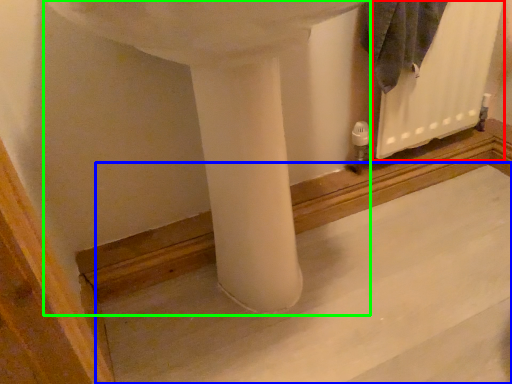
Question: Which object is the farthest from radiator (highlighted by a red box)? Choose among these: concrete (highlighted by a blue box) or sink (highlighted by a green box).

Choices:
 (A) concrete
 (B) sink

Answer: (B)